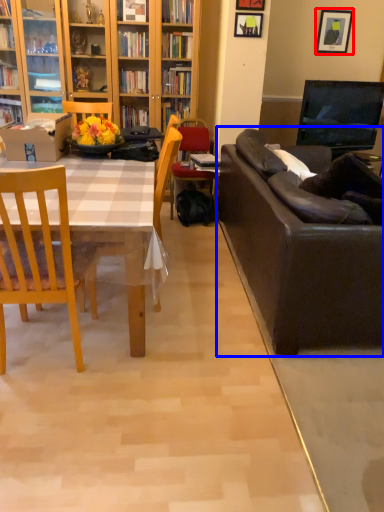
Question: Which object is closer to the camera taking this photo, picture frame (highlighted by a red box) or studio couch (highlighted by a blue box)?

Choices:
 (A) picture frame
 (B) studio couch

Answer: (B)